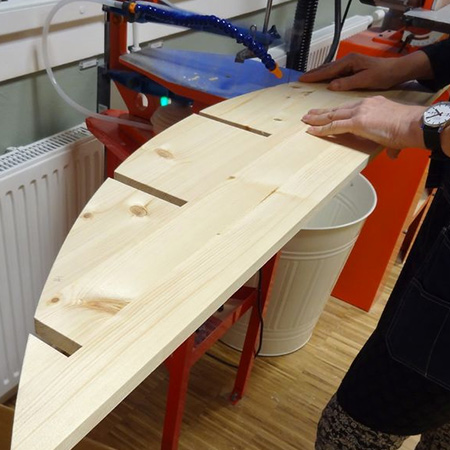
This screenshot has height=450, width=450. Identify the location of radiator. (26, 205), (322, 45), (349, 28).